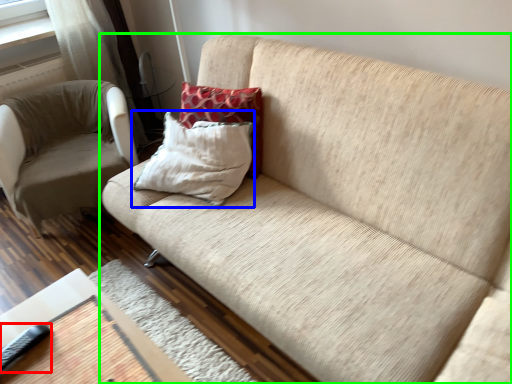
Question: Which is nearer to the remote (highlighted by a red box)? pillow (highlighted by a blue box) or studio couch (highlighted by a green box).

Choices:
 (A) pillow
 (B) studio couch

Answer: (A)